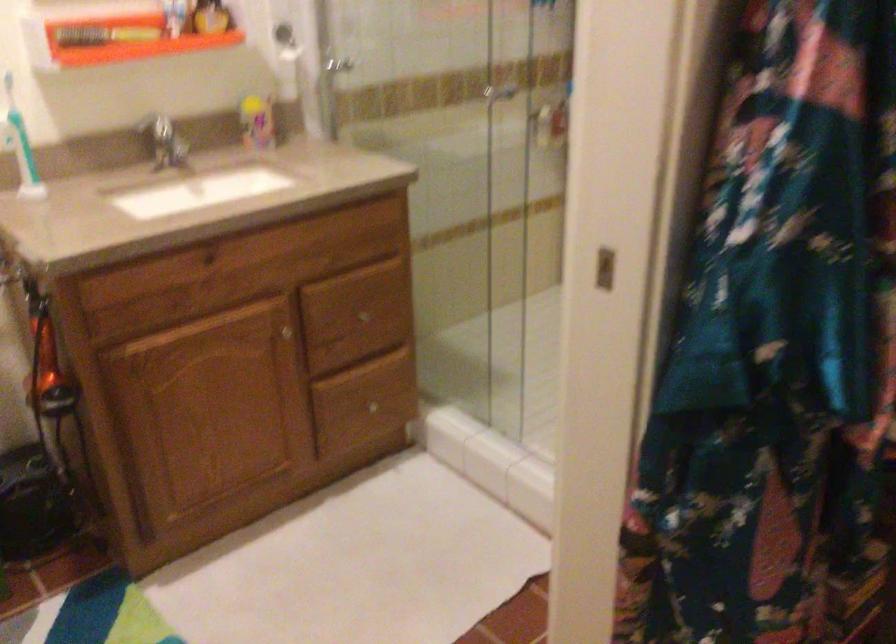
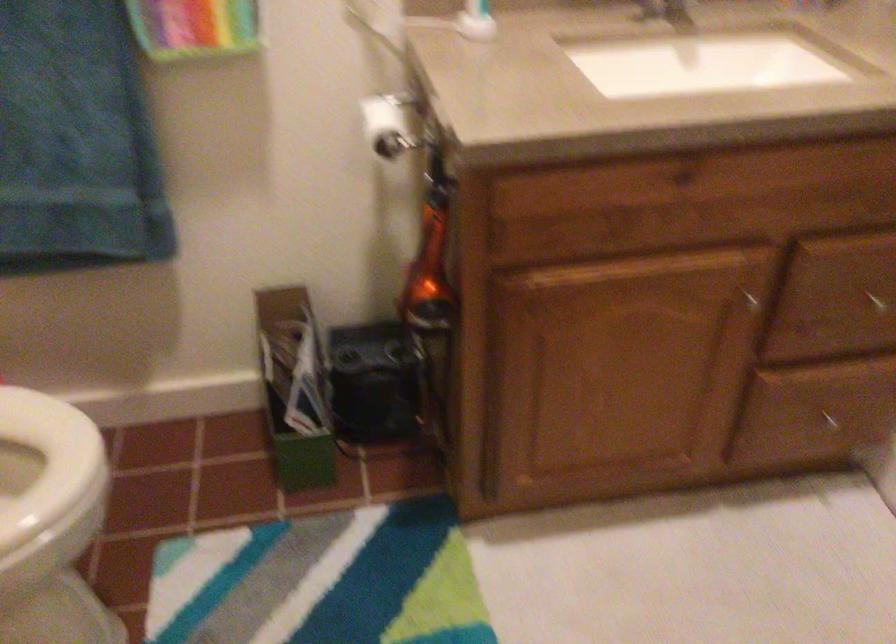
Find the pixel in the second image that matches pixel 282 326 in the first image.

(752, 285)